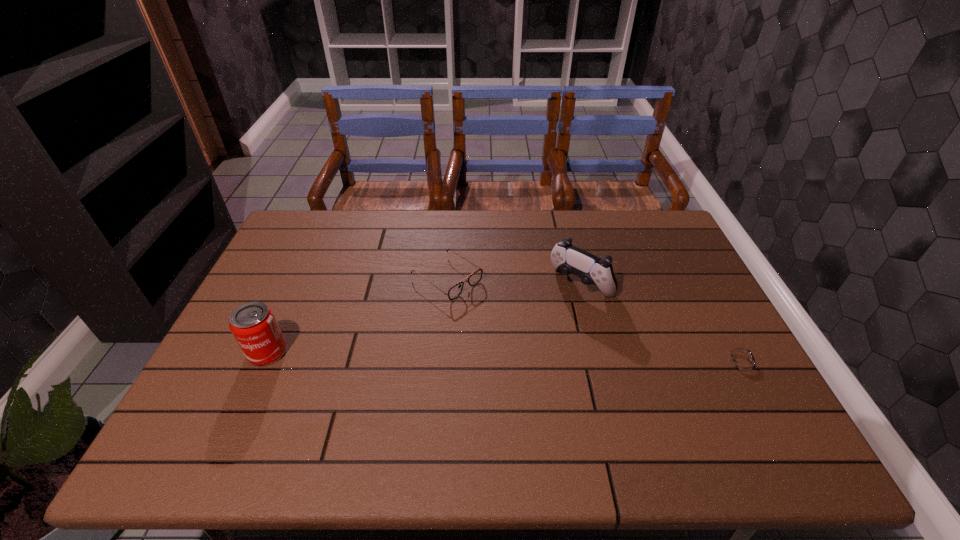
Locate an element on the screen. The width and height of the screenshot is (960, 540). can is located at coordinates (254, 326).

Find the location of `watch`. watch is located at coordinates (738, 359).

Where is `the shortest object`? The width and height of the screenshot is (960, 540). the shortest object is located at coordinates (738, 359).

Locate an element on the screen. Image resolution: width=960 pixels, height=540 pixels. control is located at coordinates (566, 258).

At what (x,y) coordinates should I click in order to perform the action: click on sunglasses. Please return your answer as a coordinate pair (x, y). Looking at the image, I should click on (474, 278).

Where is `the second shortest object`? Image resolution: width=960 pixels, height=540 pixels. the second shortest object is located at coordinates (474, 278).

Find the location of a particular element. The height and width of the screenshot is (540, 960). vacant space situated on the back of the leftmost object is located at coordinates (310, 258).

Find the location of a particular element. This screenshot has width=960, height=540. blank space located on the front-facing side of the third object from left to right is located at coordinates (512, 354).

Where is `vacant space located 0.350m on the front-facing side of the third object from left to right`? vacant space located 0.350m on the front-facing side of the third object from left to right is located at coordinates (488, 379).

You are a GUI agent. You are given a task and a screenshot of the screen. Output one action in this format:
    pyautogui.click(x=<x>, y=<y>)
    Task: Click on the vacant space situated 0.140m on the front-facing side of the third object from left to right
    The width and height of the screenshot is (960, 540).
    Given the screenshot: What is the action you would take?
    pyautogui.click(x=537, y=329)